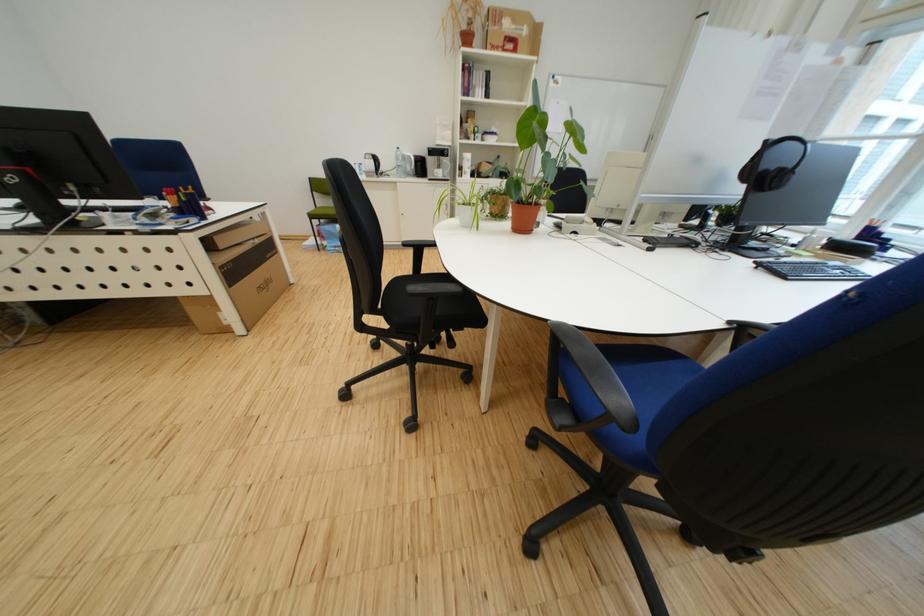
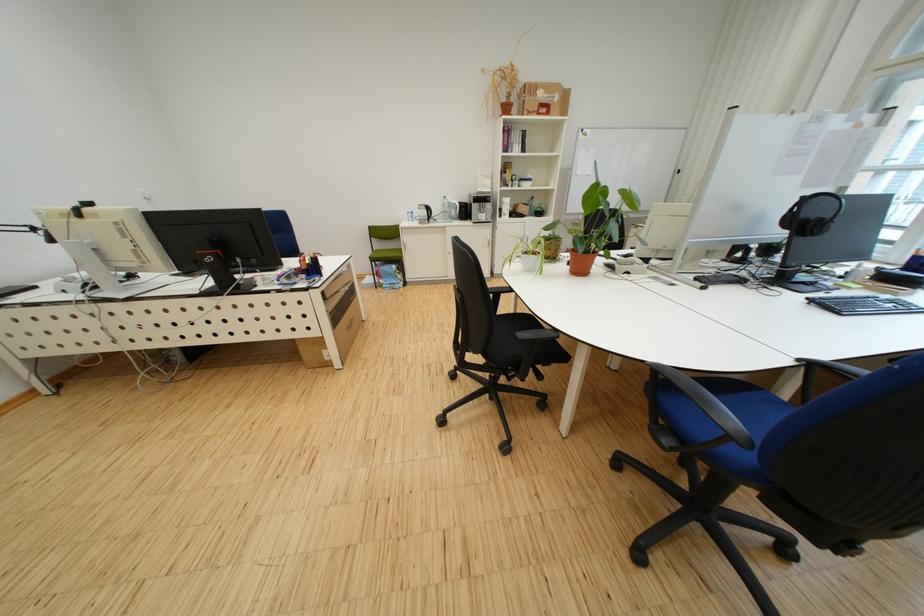
Where in the second image is the point corresponding to (186,301) from the first image?

(306, 342)